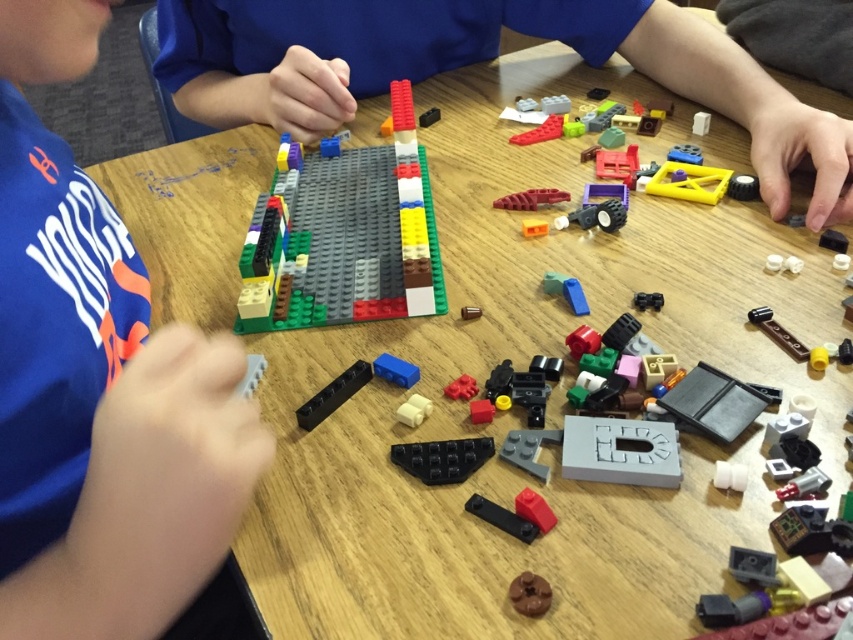
Does matte red plastic car at center come behind white matte brick at center?

Yes, matte red plastic car at center is further from the viewer.

Who is taller, matte red plastic car at center or white matte brick at center?

With more height is matte red plastic car at center.

This screenshot has height=640, width=853. Identify the location of matte red plastic car at center. (x=531, y=198).

Is brown matte gear at lower center wider than matte blue plastic brick at center?

No.

Between brown matte gear at lower center and matte blue plastic brick at center, which one appears on the left side from the viewer's perspective?

From the viewer's perspective, matte blue plastic brick at center appears more on the left side.

Find the location of a particular element. This screenshot has height=640, width=853. brown matte gear at lower center is located at coordinates (529, 595).

This screenshot has height=640, width=853. Identify the location of multicolored plastic building blocks at center. (346, 237).

Is multicolored plastic building blocks at center positioned behind blue plastic block at center?

Yes, multicolored plastic building blocks at center is behind blue plastic block at center.

Does point (346, 180) lie in front of point (573, 308)?

No, (346, 180) is behind (573, 308).

Find the location of a particular element. The height and width of the screenshot is (640, 853). multicolored plastic building blocks at center is located at coordinates (346, 237).